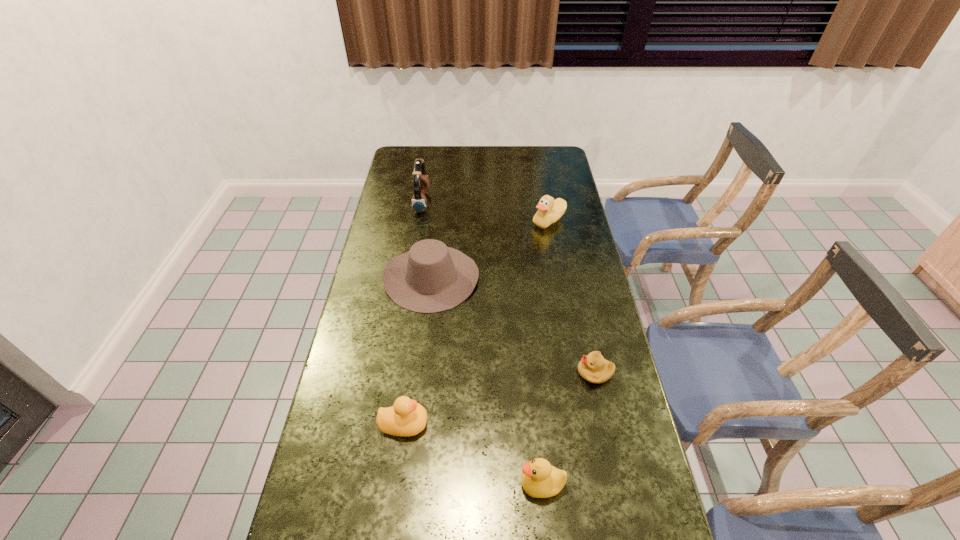
At what (x,y) coordinates should I click in order to perform the action: click on free region located 0.360m on the front-facing side of the duckling. Please return your answer as a coordinate pair (x, y). The width and height of the screenshot is (960, 540). Looking at the image, I should click on [x=450, y=373].

Where is `headset that is at the left edge`? Image resolution: width=960 pixels, height=540 pixels. headset that is at the left edge is located at coordinates (421, 184).

You are a GUI agent. You are given a task and a screenshot of the screen. Output one action in this format:
    pyautogui.click(x=<x>, y=<y>)
    Task: Click on the cowboy hat present at the left edge
    This screenshot has height=540, width=960.
    Given the screenshot: What is the action you would take?
    pyautogui.click(x=431, y=277)

You are a GUI agent. You are given a task and a screenshot of the screen. Output one action in this format:
    pyautogui.click(x=<x>, y=<y>)
    Task: Click on the duck present at the left edge
    
    Given the screenshot: What is the action you would take?
    pyautogui.click(x=406, y=417)

Identify the location of duck at the right edge. The width and height of the screenshot is (960, 540). (549, 211).

Find the location of a particular element. This screenshot has width=960, height=540. duckling at the right edge is located at coordinates (593, 368).

Where is `free space at the far edge`? free space at the far edge is located at coordinates (470, 147).

I want to click on free space at the left edge of the desktop, so click(x=324, y=538).

Where is `vacant area at the right edge of the desktop`? This screenshot has width=960, height=540. vacant area at the right edge of the desktop is located at coordinates (554, 284).

You are a GUI agent. You are given a task and a screenshot of the screen. Output one action in this format:
    pyautogui.click(x=<x>, y=<y>)
    Task: Click on the free spot between the second duck from right to left and the fourth farthest object
    The width and height of the screenshot is (960, 540).
    Given the screenshot: What is the action you would take?
    pyautogui.click(x=568, y=428)